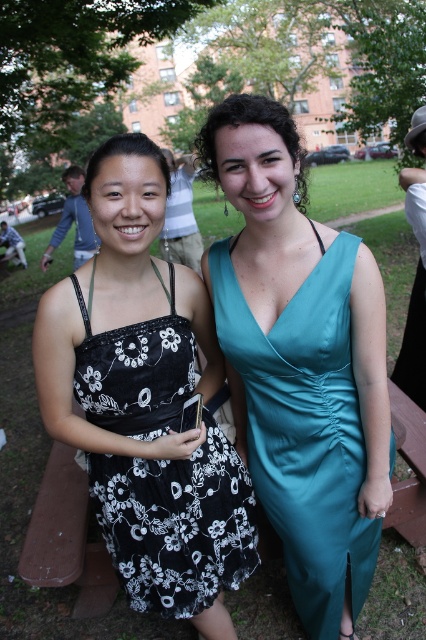
You are a photographer trying to capture the teal satin dress at center in your frame. The camera you are using has a focal length of 50mm. Based on the coordinates provided, can you determine if the dress is positioned within the recommended central focus area of the image, which is defined as the central 30x30 pixel square located at the center of the image?

The teal satin dress at center is positioned at coordinates point (x=305, y=429), which falls within the central 30x30 pixel square area. Therefore, the dress is within the recommended central focus area.

You are standing at the origin point of the image. There is a teal satin dress at center located at point (305, 429). Can you tell me the direction of the teal satin dress at center from your current position?

The teal satin dress at center is located at point (305, 429), which is to the right and slightly below the origin point.